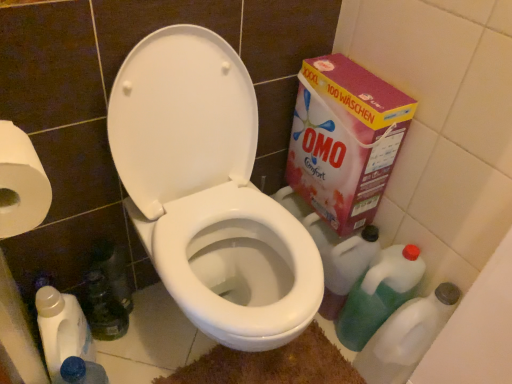
Locate an element on the screen. The image size is (512, 384). white plastic bottle at lower left, marked as the 1th cleaning product in a left-to-right arrangement is located at coordinates (62, 328).

Image resolution: width=512 pixels, height=384 pixels. Describe the element at coordinates (208, 191) in the screenshot. I see `white glossy toilet at center` at that location.

Identify the location of green translucent bottle at lower right, placed as the 3th cleaning product when sorted from left to right. The height and width of the screenshot is (384, 512). (379, 294).

In order to face pink cardboard box at right, should I rotate leftwards or rightwards?

It's best to rotate right around 11.224 degrees.

Image resolution: width=512 pixels, height=384 pixels. Find the location of `white plastic bottle at lower left, which is the 4th cleaning product from right to left`. white plastic bottle at lower left, which is the 4th cleaning product from right to left is located at coordinates (62, 328).

Is brown textured bath mat at lower center oriented towards white paper at left?

No, brown textured bath mat at lower center is not turned towards white paper at left.

Is point (242, 366) less distant than point (2, 205)?

No, it is not.

Can you confirm if brown textured bath mat at lower center is thinner than white paper at left?

Incorrect, the width of brown textured bath mat at lower center is not less than that of white paper at left.

Considering the positions of objects brown textured bath mat at lower center and white paper at left in the image provided, who is more to the right, brown textured bath mat at lower center or white paper at left?

brown textured bath mat at lower center.

From a real-world perspective, is pink cardboard box at right above or below green plastic cleaner at lower right, acting as the second cleaning product starting from the left?

From a real-world perspective, pink cardboard box at right is physically above green plastic cleaner at lower right, acting as the second cleaning product starting from the left.

Is pink cardboard box at right shorter than green plastic cleaner at lower right, acting as the second cleaning product starting from the left?

No, pink cardboard box at right is not shorter than green plastic cleaner at lower right, acting as the second cleaning product starting from the left.

Considering the positions of point (385, 129) and point (349, 287), is point (385, 129) closer or farther from the camera than point (349, 287)?

Point (385, 129) is closer to the camera than point (349, 287).

Is green plastic cleaner at lower right, acting as the second cleaning product starting from the left, turned away from white plastic bottle at lower left, which is the 4th cleaning product from right to left?

No, white plastic bottle at lower left, which is the 4th cleaning product from right to left, is not at the back of green plastic cleaner at lower right, acting as the second cleaning product starting from the left.

Is green plastic cleaner at lower right, which ranks as the third cleaning product in right-to-left order, directly adjacent to white plastic bottle at lower left, which is the 4th cleaning product from right to left?

There is a gap between green plastic cleaner at lower right, which ranks as the third cleaning product in right-to-left order, and white plastic bottle at lower left, which is the 4th cleaning product from right to left.

Does green plastic cleaner at lower right, which ranks as the third cleaning product in right-to-left order, have a greater height compared to white plastic bottle at lower left, which is the 4th cleaning product from right to left?

No.

From the picture: From the image's perspective, is green plastic cleaner at lower right, which ranks as the third cleaning product in right-to-left order, above or below white plastic bottle at lower left, which is the 4th cleaning product from right to left?

Clearly, from the image's perspective, green plastic cleaner at lower right, which ranks as the third cleaning product in right-to-left order, is above white plastic bottle at lower left, which is the 4th cleaning product from right to left.

Considering the positions of point (88, 274) and point (44, 354), is point (88, 274) closer or farther from the camera than point (44, 354)?

Point (88, 274) is positioned farther from the camera compared to point (44, 354).

From the image's perspective, between translucent plastic bottle at lower left and white plastic bottle at lower left, marked as the 1th cleaning product in a left-to-right arrangement, who is located below?

white plastic bottle at lower left, marked as the 1th cleaning product in a left-to-right arrangement.

Is translucent plastic bottle at lower left directly adjacent to white plastic bottle at lower left, marked as the 1th cleaning product in a left-to-right arrangement?

Yes, translucent plastic bottle at lower left is next to white plastic bottle at lower left, marked as the 1th cleaning product in a left-to-right arrangement.

Is translucent plastic bottle at lower left in front of or behind white plastic bottle at lower left, which is the 4th cleaning product from right to left, in the image?

Clearly, translucent plastic bottle at lower left is behind white plastic bottle at lower left, which is the 4th cleaning product from right to left.

Identify the location of the 1st cleaning product below the pink cardboard box at right (from the image's perspective). Image resolution: width=512 pixels, height=384 pixels. (345, 267).

Looking at this image, is green plastic cleaner at lower right, acting as the second cleaning product starting from the left, inside or outside of pink cardboard box at right?

green plastic cleaner at lower right, acting as the second cleaning product starting from the left, is outside pink cardboard box at right.

Consider the image. In terms of size, does green plastic cleaner at lower right, acting as the second cleaning product starting from the left, appear bigger or smaller than pink cardboard box at right?

Considering their sizes, green plastic cleaner at lower right, acting as the second cleaning product starting from the left, takes up less space than pink cardboard box at right.

In the scene shown: Between green plastic cleaner at lower right, which ranks as the third cleaning product in right-to-left order, and pink cardboard box at right, which one has more height?

Standing taller between the two is pink cardboard box at right.

In the image, is pink cardboard box at right positioned in front of or behind green plastic cleaner at lower right, which is counted as the first cleaning product, starting from the right?

pink cardboard box at right is in front of green plastic cleaner at lower right, which is counted as the first cleaning product, starting from the right.

Is pink cardboard box at right in contact with green plastic cleaner at lower right, placed as the 4th cleaning product when sorted from left to right?

No, pink cardboard box at right is not with green plastic cleaner at lower right, placed as the 4th cleaning product when sorted from left to right.

From the image's perspective, is pink cardboard box at right positioned above or below green plastic cleaner at lower right, which is counted as the first cleaning product, starting from the right?

Based on their image positions, pink cardboard box at right is located above green plastic cleaner at lower right, which is counted as the first cleaning product, starting from the right.

Does green translucent bottle at lower right, which ranks as the second cleaning product in right-to-left order, turn towards white paper at left?

No, green translucent bottle at lower right, which ranks as the second cleaning product in right-to-left order, is not oriented towards white paper at left.

Is white paper at left located within green translucent bottle at lower right, which ranks as the second cleaning product in right-to-left order?

That's incorrect, white paper at left is not inside green translucent bottle at lower right, which ranks as the second cleaning product in right-to-left order.

Is green translucent bottle at lower right, which ranks as the second cleaning product in right-to-left order, to the left of white paper at left from the viewer's perspective?

No, green translucent bottle at lower right, which ranks as the second cleaning product in right-to-left order, is not to the left of white paper at left.

Find the location of a particular element. bath mat on the right side of white paper at left is located at coordinates (271, 364).

The image size is (512, 384). There is a pink cardboard box at right. What are the coordinates of `the 4th cleaning product below it (from a real-world perspective)` in the screenshot? It's located at (345, 267).

Based on their spatial positions, is white glossy toilet at center or brown textured bath mat at lower center closer to white plastic bottle at lower left, marked as the 1th cleaning product in a left-to-right arrangement?

white glossy toilet at center lies closer to white plastic bottle at lower left, marked as the 1th cleaning product in a left-to-right arrangement, than the other object.

Which object lies further to the anchor point pink cardboard box at right, green plastic cleaner at lower right, acting as the second cleaning product starting from the left, or white plastic bottle at lower left, marked as the 1th cleaning product in a left-to-right arrangement?

white plastic bottle at lower left, marked as the 1th cleaning product in a left-to-right arrangement, is further to pink cardboard box at right.

Consider the image. When comparing their distances from brown textured bath mat at lower center, does green plastic cleaner at lower right, placed as the 4th cleaning product when sorted from left to right, or green translucent bottle at lower right, which ranks as the second cleaning product in right-to-left order, seem further?

green translucent bottle at lower right, which ranks as the second cleaning product in right-to-left order, lies further to brown textured bath mat at lower center than the other object.

Which object lies further to the anchor point white glossy toilet at center, white plastic bottle at lower left, which is the 4th cleaning product from right to left, or translucent plastic bottle at lower left?

white plastic bottle at lower left, which is the 4th cleaning product from right to left, is positioned further to the anchor white glossy toilet at center.

Consider the image. Which object lies further to the anchor point white paper at left, brown textured bath mat at lower center or white plastic bottle at lower left, which is the 4th cleaning product from right to left?

brown textured bath mat at lower center is further to white paper at left.

Looking at the image, which one is located further to translucent plastic bottle at lower left, green translucent bottle at lower right, placed as the 3th cleaning product when sorted from left to right, or white glossy toilet at center?

green translucent bottle at lower right, placed as the 3th cleaning product when sorted from left to right, is further to translucent plastic bottle at lower left.

Considering their positions, is green plastic cleaner at lower right, which ranks as the third cleaning product in right-to-left order, positioned further to translucent plastic bottle at lower left than green translucent bottle at lower right, which ranks as the second cleaning product in right-to-left order?

green translucent bottle at lower right, which ranks as the second cleaning product in right-to-left order, is further to translucent plastic bottle at lower left.

Looking at the image, which one is located closer to green plastic cleaner at lower right, which is counted as the first cleaning product, starting from the right, brown textured bath mat at lower center or green plastic cleaner at lower right, which ranks as the third cleaning product in right-to-left order?

green plastic cleaner at lower right, which ranks as the third cleaning product in right-to-left order, is positioned closer to the anchor green plastic cleaner at lower right, which is counted as the first cleaning product, starting from the right.

This screenshot has height=384, width=512. Find the location of `bath mat located between white plastic bottle at lower left, which is the 4th cleaning product from right to left, and green plastic cleaner at lower right, placed as the 4th cleaning product when sorted from left to right, in the left-right direction`. bath mat located between white plastic bottle at lower left, which is the 4th cleaning product from right to left, and green plastic cleaner at lower right, placed as the 4th cleaning product when sorted from left to right, in the left-right direction is located at coordinates (271, 364).

The image size is (512, 384). In order to click on cardboard box between white paper at left and green plastic cleaner at lower right, placed as the 4th cleaning product when sorted from left to right, in the horizontal direction in this screenshot , I will do `click(345, 139)`.

You are a GUI agent. You are given a task and a screenshot of the screen. Output one action in this format:
    pyautogui.click(x=<x>, y=<y>)
    Task: Click on the cardboard box between translucent plastic bottle at lower left and green plastic cleaner at lower right, which is counted as the first cleaning product, starting from the right, in the horizontal direction
    
    Given the screenshot: What is the action you would take?
    pyautogui.click(x=345, y=139)

At what (x,y) coordinates should I click in order to perform the action: click on bath mat between translucent plastic bottle at lower left and green plastic cleaner at lower right, acting as the second cleaning product starting from the left, from left to right. Please return your answer as a coordinate pair (x, y). Looking at the image, I should click on (271, 364).